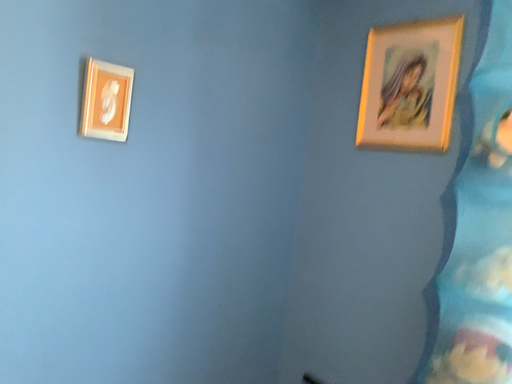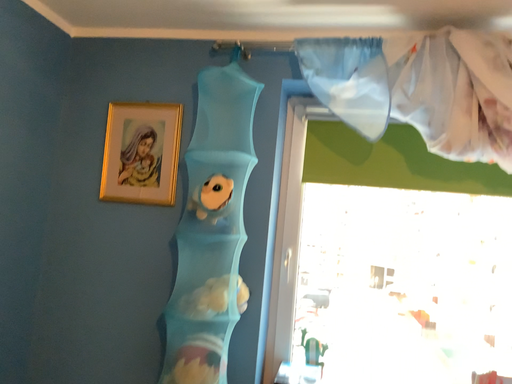
Question: How did the camera likely rotate when shooting the video?

Choices:
 (A) rotated left
 (B) rotated right

Answer: (B)